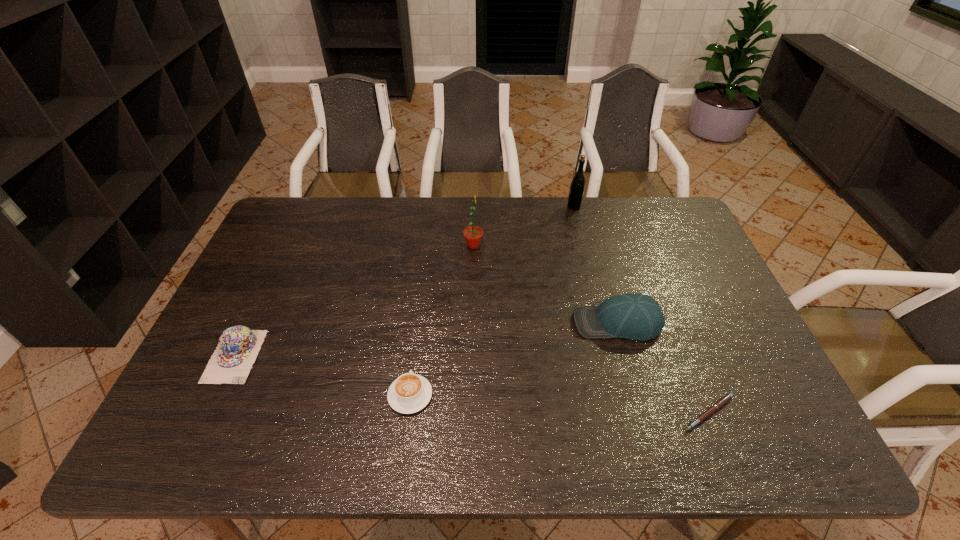
Locate an element on the screen. This screenshot has height=540, width=960. object situated at the right edge is located at coordinates (726, 398).

Find the location of `object at the near right corner`. object at the near right corner is located at coordinates (726, 398).

Where is `vacant area at the far edge of the desktop`? The width and height of the screenshot is (960, 540). vacant area at the far edge of the desktop is located at coordinates (404, 202).

At what (x,y) coordinates should I click in order to perform the action: click on vacant space at the near edge of the desktop. Please return your answer as a coordinate pair (x, y). Looking at the image, I should click on 281,446.

The height and width of the screenshot is (540, 960). What are the coordinates of `vacant space at the left edge of the desktop` in the screenshot? It's located at (274, 317).

This screenshot has width=960, height=540. In the image, there is a desktop. What are the coordinates of `blank space at the right edge` in the screenshot? It's located at (689, 298).

The width and height of the screenshot is (960, 540). Find the location of `vacant space at the far left corner of the desktop`. vacant space at the far left corner of the desktop is located at coordinates (321, 210).

Find the location of `vacant space at the near right corner of the desktop`. vacant space at the near right corner of the desktop is located at coordinates (757, 442).

At what (x,y) coordinates should I click in order to perform the action: click on blank region between the baseball cap and the second shortest object. Please return your answer as a coordinate pair (x, y). Looking at the image, I should click on (514, 359).

Identify the location of vacant space that's between the fourth shortest object and the second farthest object. (545, 284).